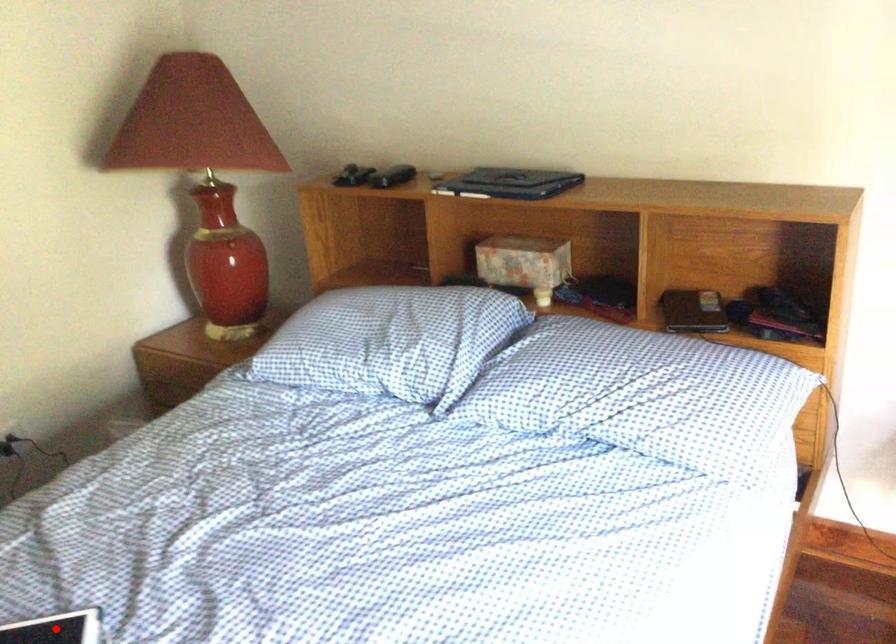
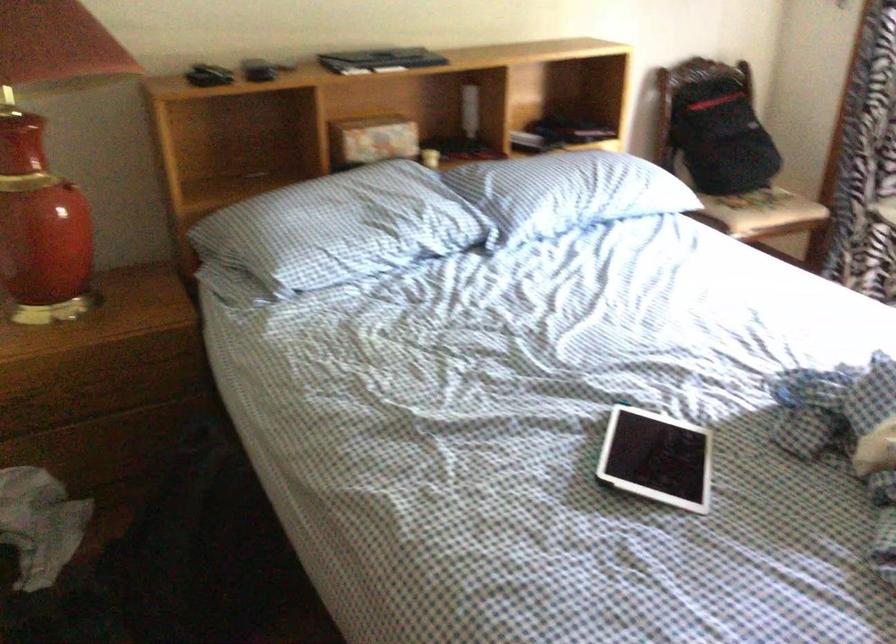
Question: I am providing you with two images of the same scene from different viewpoints. A red point is marked on the first image. At the location where the point appears in image 1, is it still visible in image 2?

Choices:
 (A) Yes
 (B) No

Answer: (B)